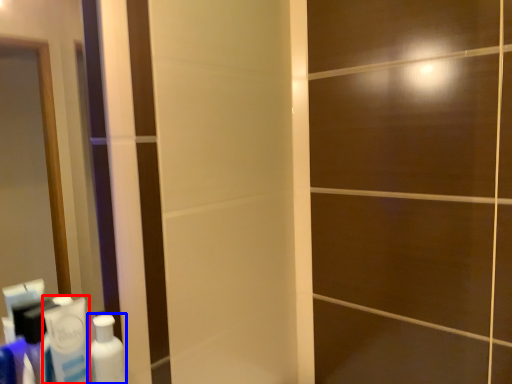
Question: Which object appears closest to the camera in this image, toothpaste (highlighted by a red box) or bottle (highlighted by a blue box)?

Choices:
 (A) toothpaste
 (B) bottle

Answer: (A)